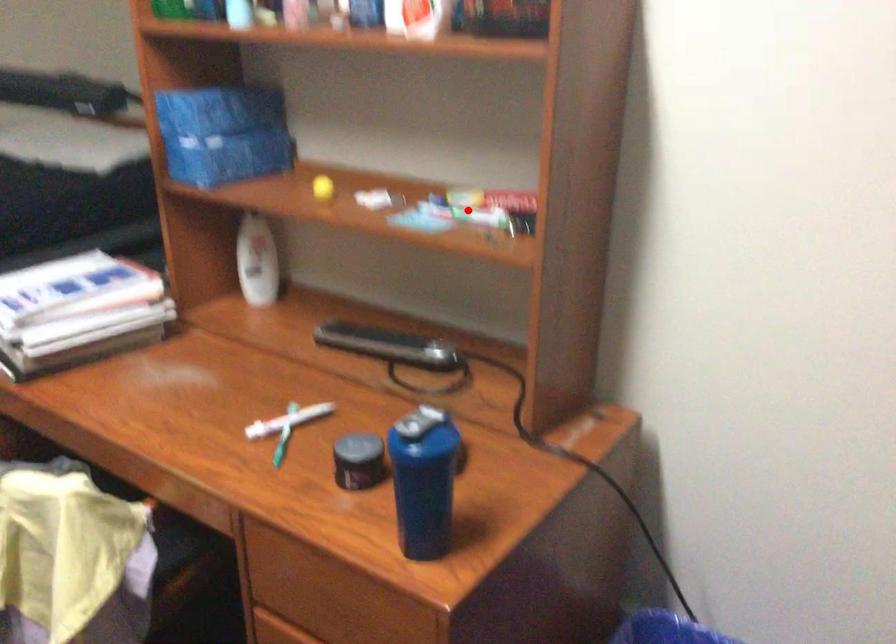
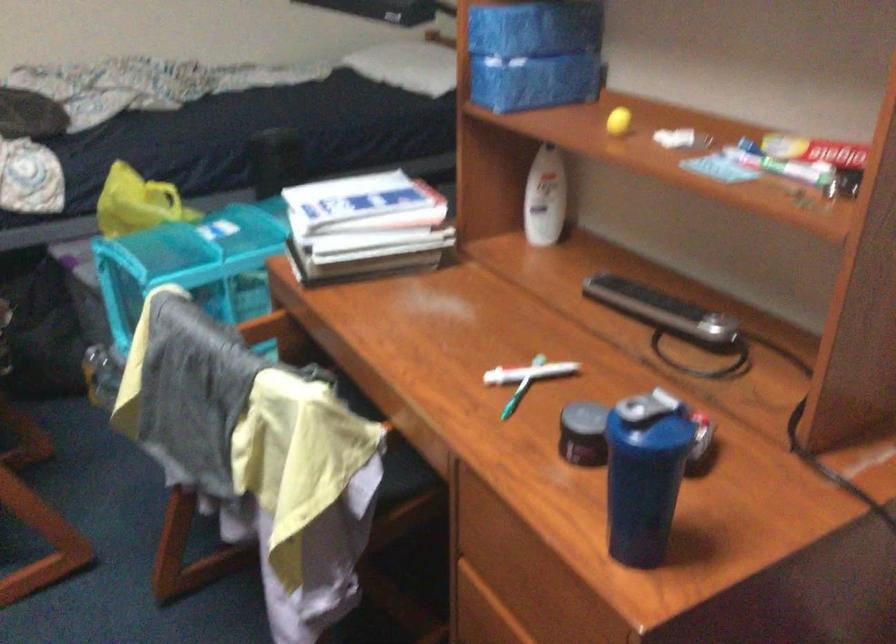
Locate, in the second image, the point that corresponds to the highlighted location in the first image.

(780, 164)